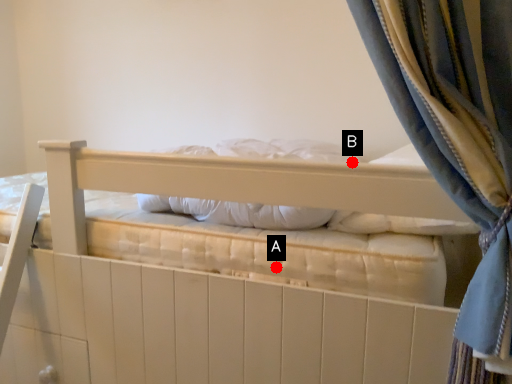
Question: Two points are circled on the image, labeled by A and B beside each circle. Which point is farther from the camera taking this photo?

Choices:
 (A) A is further
 (B) B is further

Answer: (A)